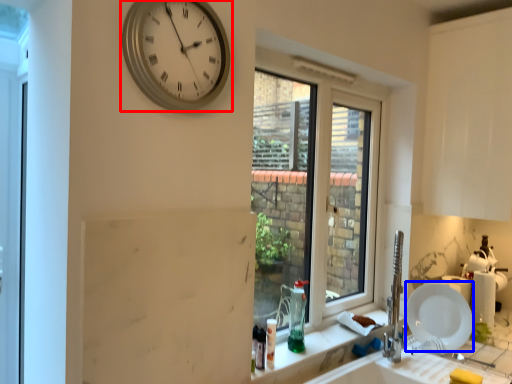
Question: Which point is further to the camera, wall clock (highlighted by a red box) or plate (highlighted by a blue box)?

Choices:
 (A) wall clock
 (B) plate

Answer: (B)